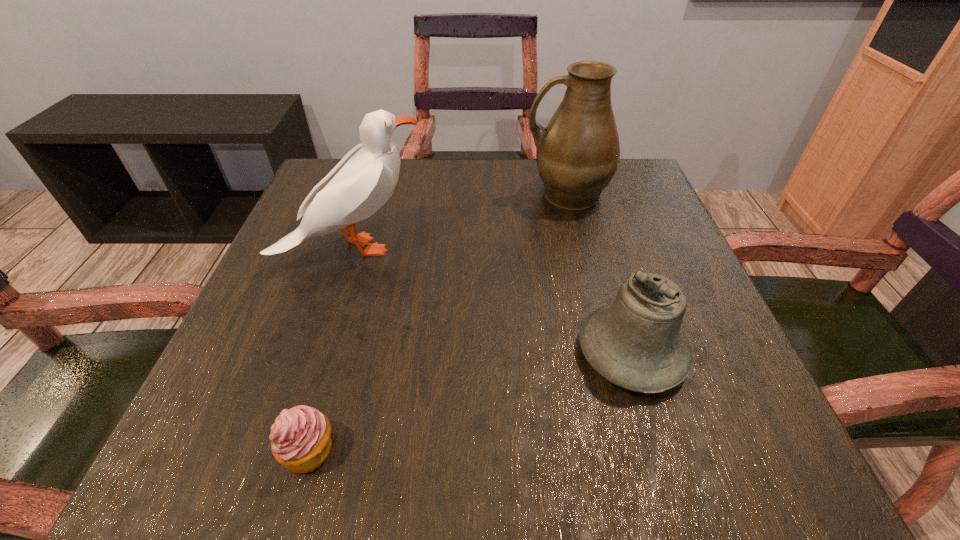
You are a GUI agent. You are given a task and a screenshot of the screen. Output one action in this format:
    pyautogui.click(x=<x>, y=<y>)
    Task: Click on the free space that is in between the gull and the nearest object
    This screenshot has width=960, height=540.
    Given the screenshot: What is the action you would take?
    pyautogui.click(x=331, y=349)

Find the location of a particular element. vacant region between the third tallest object and the nearest object is located at coordinates (470, 401).

Locate an element on the screen. free space between the pitcher and the gull is located at coordinates (460, 221).

Locate an element on the screen. The height and width of the screenshot is (540, 960). vacant area that lies between the farthest object and the third tallest object is located at coordinates (599, 273).

Where is `free area in between the second shortest object and the pitcher`? The width and height of the screenshot is (960, 540). free area in between the second shortest object and the pitcher is located at coordinates pyautogui.click(x=599, y=273).

Find the location of a particular element. The width and height of the screenshot is (960, 540). free space between the pitcher and the second nearest object is located at coordinates (599, 273).

Identify which object is located as the nearest to the third tallest object. Please provide its 2D coordinates. Your answer should be formatted as a tuple, i.e. [(x, y)], where the tuple contains the x and y coordinates of a point satisfying the conditions above.

[(577, 154)]

Where is `object that is the third closest one to the pitcher`? This screenshot has width=960, height=540. object that is the third closest one to the pitcher is located at coordinates (300, 438).

Where is `free space that satisfies the following two spatial constraints: 1. at the beak of the third tallest object; 2. on the right side of the third nearest object`? The image size is (960, 540). free space that satisfies the following two spatial constraints: 1. at the beak of the third tallest object; 2. on the right side of the third nearest object is located at coordinates pos(320,353).

Locate an element on the screen. This screenshot has height=540, width=960. vacant space that satisfies the following two spatial constraints: 1. at the beak of the shortest object; 2. on the right side of the gull is located at coordinates (288, 450).